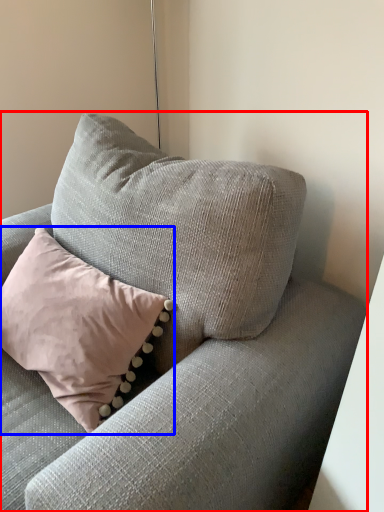
Question: Among these objects, which one is farthest to the camera, studio couch (highlighted by a red box) or pillow (highlighted by a blue box)?

Choices:
 (A) studio couch
 (B) pillow

Answer: (B)